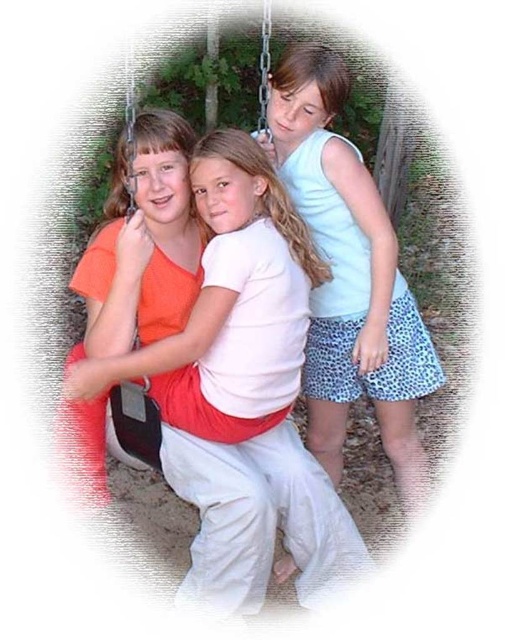
You are a photographer trying to capture a closeup of the light blue fabric shorts at center and the matte red swing at center. Which object is closer to the camera?

The light blue fabric shorts at center is closer to the camera than the matte red swing at center.

You are a photographer trying to capture a closeup of the light blue fabric shorts at center and the matte red swing at center. Given that your camera can only focus on one object at a time, which object should you choose to ensure it appears larger in the photo?

The light blue fabric shorts at center is bigger than the matte red swing at center, so to ensure the object appears larger in the photo, you should choose the light blue fabric shorts at center.